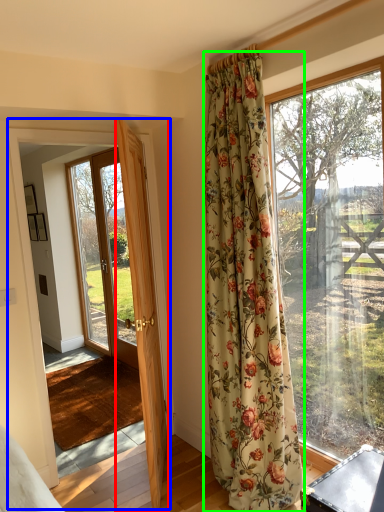
Question: Based on their relative distances, which object is farther from door (highlighted by a red box)? Choose from barn door (highlighted by a blue box) and curtain (highlighted by a green box).

Choices:
 (A) barn door
 (B) curtain

Answer: (B)